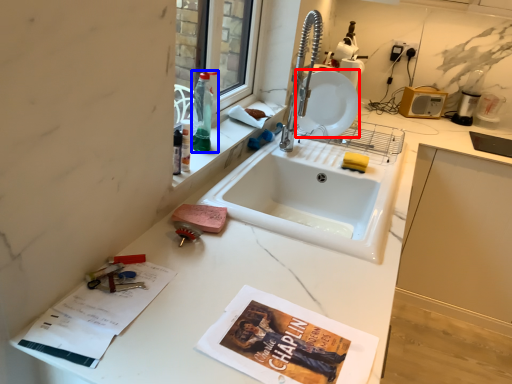
Question: Which object is closer to the camera taking this photo, plate (highlighted by a red box) or bottle (highlighted by a blue box)?

Choices:
 (A) plate
 (B) bottle

Answer: (B)